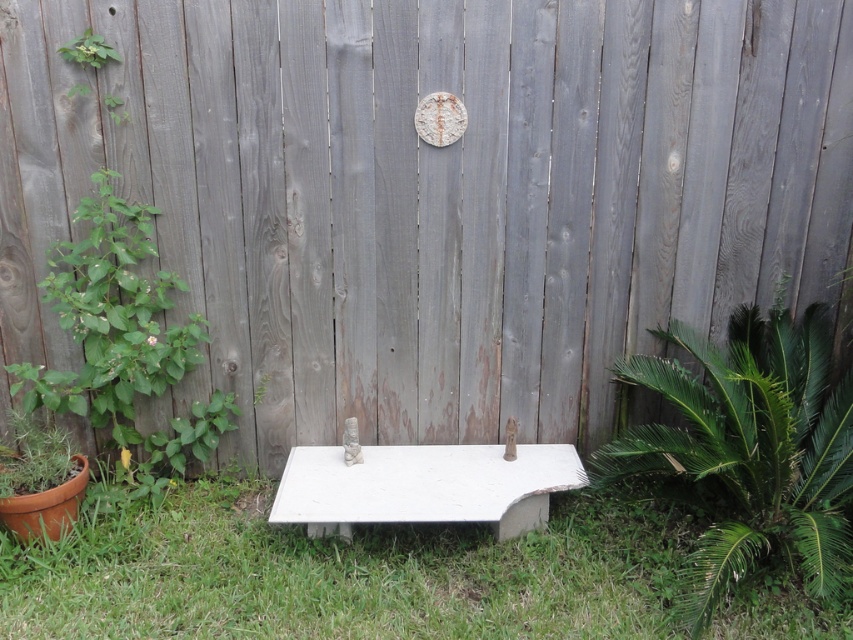
Is point (151, 582) less distant than point (102, 44)?

Yes, it is.

Can you confirm if green grass at lower center is wider than green leafy plant at upper left?

Yes, green grass at lower center is wider than green leafy plant at upper left.

Where is `green grass at lower center`? green grass at lower center is located at coordinates (344, 573).

Does green leafy plant at lower right have a greater height compared to green leafy plant at upper left?

Indeed, green leafy plant at lower right has a greater height compared to green leafy plant at upper left.

Which is behind, point (840, 406) or point (84, 52)?

The point (840, 406) is more distant.

This screenshot has width=853, height=640. Describe the element at coordinates (746, 449) in the screenshot. I see `green leafy plant at lower right` at that location.

Find the location of a particular element. The image size is (853, 640). green leafy plant at lower right is located at coordinates (746, 449).

Who is more forward, (759,477) or (450,465)?

Point (759,477) is in front.

Consider the image. Does green leafy plant at lower right have a greater width compared to white concrete bench at center?

No.

Where is `green leafy plant at lower right`? This screenshot has width=853, height=640. green leafy plant at lower right is located at coordinates (746, 449).